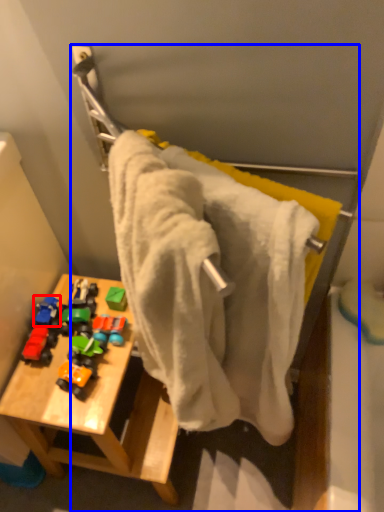
Question: Which of the following is the farthest to the observer, toy (highlighted by a red box) or towel rack (highlighted by a blue box)?

Choices:
 (A) toy
 (B) towel rack

Answer: (A)